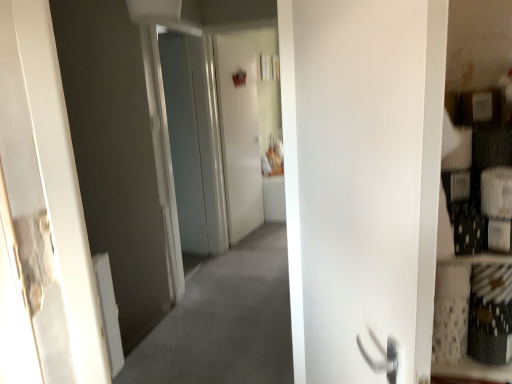
What are the coordinates of `transparent glass door at center, arranged as the 1th screen door when viewed from the left` in the screenshot? It's located at (195, 141).

Measure the distance between white matte door at right and camera.

white matte door at right and camera are 24.58 inches apart.

Identify the location of transparent glass door at center, which appears as the second screen door when viewed from the right. The height and width of the screenshot is (384, 512). (195, 141).

Which is closer, (209, 239) or (351, 211)?

The point (351, 211) is closer.

Considering the sizes of objects transparent glass door at center, which appears as the second screen door when viewed from the right, and white matte door at right in the image provided, who is smaller, transparent glass door at center, which appears as the second screen door when viewed from the right, or white matte door at right?

white matte door at right.

Is transparent glass door at center, which appears as the second screen door when viewed from the right, closer to the viewer compared to white matte door at right?

No, transparent glass door at center, which appears as the second screen door when viewed from the right, is further to the viewer.

In the scene shown: Considering the relative sizes of white matte door at right and transparent glass door at center, which appears as the second screen door when viewed from the right, in the image provided, is white matte door at right smaller than transparent glass door at center, which appears as the second screen door when viewed from the right,?

Yes, white matte door at right is smaller than transparent glass door at center, which appears as the second screen door when viewed from the right.

Measure the distance from white matte door at right to transparent glass door at center, arranged as the 1th screen door when viewed from the left.

The distance of white matte door at right from transparent glass door at center, arranged as the 1th screen door when viewed from the left, is 8.72 feet.

Based on the photo, from a real-world perspective, which object rests below the other?

From a 3D spatial view, transparent glass door at center, which appears as the second screen door when viewed from the right, is below.

Would you consider white matte door at right to be distant from transparent glass door at center, which appears as the second screen door when viewed from the right?

Indeed, white matte door at right is not near transparent glass door at center, which appears as the second screen door when viewed from the right.

Is white glossy door at center, the 2th screen door viewed from the left, in front of or behind transparent glass door at center, arranged as the 1th screen door when viewed from the left, in the image?

Visually, white glossy door at center, the 2th screen door viewed from the left, is located behind transparent glass door at center, arranged as the 1th screen door when viewed from the left.

Can you tell me how much white glossy door at center, which is counted as the 1th screen door, starting from the right, and transparent glass door at center, which appears as the second screen door when viewed from the right, differ in facing direction?

The angular difference between white glossy door at center, which is counted as the 1th screen door, starting from the right, and transparent glass door at center, which appears as the second screen door when viewed from the right, is 11.3 degrees.

From a real-world perspective, which is physically above, white glossy door at center, which is counted as the 1th screen door, starting from the right, or transparent glass door at center, arranged as the 1th screen door when viewed from the left?

In real-world perspective, transparent glass door at center, arranged as the 1th screen door when viewed from the left, is above.

Would you consider white glossy door at center, which is counted as the 1th screen door, starting from the right, to be distant from transparent glass door at center, which appears as the second screen door when viewed from the right?

That's not correct — white glossy door at center, which is counted as the 1th screen door, starting from the right, is a little close to transparent glass door at center, which appears as the second screen door when viewed from the right.

Is white glossy door at center, which is counted as the 1th screen door, starting from the right, completely or partially outside of white matte door at right?

Absolutely, white glossy door at center, which is counted as the 1th screen door, starting from the right, is external to white matte door at right.

Identify the location of screen door that is the 1st one when counting leftward from the white matte door at right. This screenshot has width=512, height=384. (239, 134).

Are white glossy door at center, which is counted as the 1th screen door, starting from the right, and white matte door at right beside each other?

No, white glossy door at center, which is counted as the 1th screen door, starting from the right, is not beside white matte door at right.

Can you confirm if white glossy door at center, which is counted as the 1th screen door, starting from the right, is smaller than white matte door at right?

Yes, white glossy door at center, which is counted as the 1th screen door, starting from the right, is smaller than white matte door at right.

Which of these two, transparent glass door at center, arranged as the 1th screen door when viewed from the left, or white glossy door at center, which is counted as the 1th screen door, starting from the right, stands taller?

Standing taller between the two is transparent glass door at center, arranged as the 1th screen door when viewed from the left.

Considering the sizes of objects transparent glass door at center, which appears as the second screen door when viewed from the right, and white glossy door at center, which is counted as the 1th screen door, starting from the right, in the image provided, who is smaller, transparent glass door at center, which appears as the second screen door when viewed from the right, or white glossy door at center, which is counted as the 1th screen door, starting from the right,?

white glossy door at center, which is counted as the 1th screen door, starting from the right, is smaller.

Is white glossy door at center, which is counted as the 1th screen door, starting from the right, surrounded by transparent glass door at center, arranged as the 1th screen door when viewed from the left?

No, white glossy door at center, which is counted as the 1th screen door, starting from the right, is located outside of transparent glass door at center, arranged as the 1th screen door when viewed from the left.

How different are the orientations of transparent glass door at center, which appears as the second screen door when viewed from the right, and white glossy door at center, which is counted as the 1th screen door, starting from the right, in degrees?

The facing directions of transparent glass door at center, which appears as the second screen door when viewed from the right, and white glossy door at center, which is counted as the 1th screen door, starting from the right, are 11.3 degrees apart.

Considering the positions of points (412, 360) and (238, 208), is point (412, 360) farther from camera compared to point (238, 208)?

That is False.

Considering the sizes of objects white matte door at right and white glossy door at center, the 2th screen door viewed from the left, in the image provided, who is shorter, white matte door at right or white glossy door at center, the 2th screen door viewed from the left,?

white matte door at right is shorter.

From a real-world perspective, who is located lower, white matte door at right or white glossy door at center, which is counted as the 1th screen door, starting from the right?

white glossy door at center, which is counted as the 1th screen door, starting from the right.

Does white matte door at right touch white glossy door at center, which is counted as the 1th screen door, starting from the right?

No.

There is a white matte door at right. Where is `the 1st screen door above it (from the image's perspective)`? The image size is (512, 384). the 1st screen door above it (from the image's perspective) is located at coordinates (195, 141).

I want to click on door below the transparent glass door at center, which appears as the second screen door when viewed from the right (from the image's perspective), so tap(362, 182).

From the image, which object appears to be nearer to white glossy door at center, which is counted as the 1th screen door, starting from the right, white matte door at right or transparent glass door at center, arranged as the 1th screen door when viewed from the left?

The object closer to white glossy door at center, which is counted as the 1th screen door, starting from the right, is transparent glass door at center, arranged as the 1th screen door when viewed from the left.

From the image, which object appears to be nearer to transparent glass door at center, which appears as the second screen door when viewed from the right, white glossy door at center, which is counted as the 1th screen door, starting from the right, or white matte door at right?

white glossy door at center, which is counted as the 1th screen door, starting from the right, is positioned closer to the anchor transparent glass door at center, which appears as the second screen door when viewed from the right.

Which object lies nearer to the anchor point white glossy door at center, the 2th screen door viewed from the left, transparent glass door at center, which appears as the second screen door when viewed from the right, or white matte door at right?

transparent glass door at center, which appears as the second screen door when viewed from the right, is closer to white glossy door at center, the 2th screen door viewed from the left.

From the image, which object appears to be nearer to transparent glass door at center, arranged as the 1th screen door when viewed from the left, white matte door at right or white glossy door at center, which is counted as the 1th screen door, starting from the right?

Among the two, white glossy door at center, which is counted as the 1th screen door, starting from the right, is located nearer to transparent glass door at center, arranged as the 1th screen door when viewed from the left.

In the scene shown: Estimate the real-world distances between objects in this image. Which object is further from white matte door at right, transparent glass door at center, which appears as the second screen door when viewed from the right, or white glossy door at center, the 2th screen door viewed from the left?

Based on the image, white glossy door at center, the 2th screen door viewed from the left, appears to be further to white matte door at right.

From the image, which object appears to be nearer to white matte door at right, white glossy door at center, the 2th screen door viewed from the left, or transparent glass door at center, arranged as the 1th screen door when viewed from the left?

transparent glass door at center, arranged as the 1th screen door when viewed from the left.

The height and width of the screenshot is (384, 512). Find the location of `screen door located between white matte door at right and white glossy door at center, which is counted as the 1th screen door, starting from the right, in the depth direction`. screen door located between white matte door at right and white glossy door at center, which is counted as the 1th screen door, starting from the right, in the depth direction is located at coordinates (195, 141).